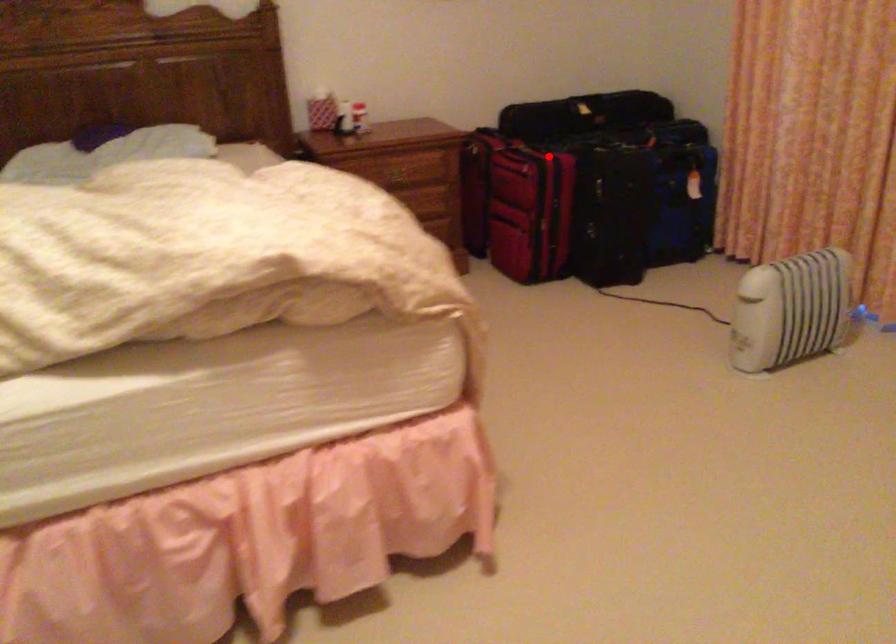
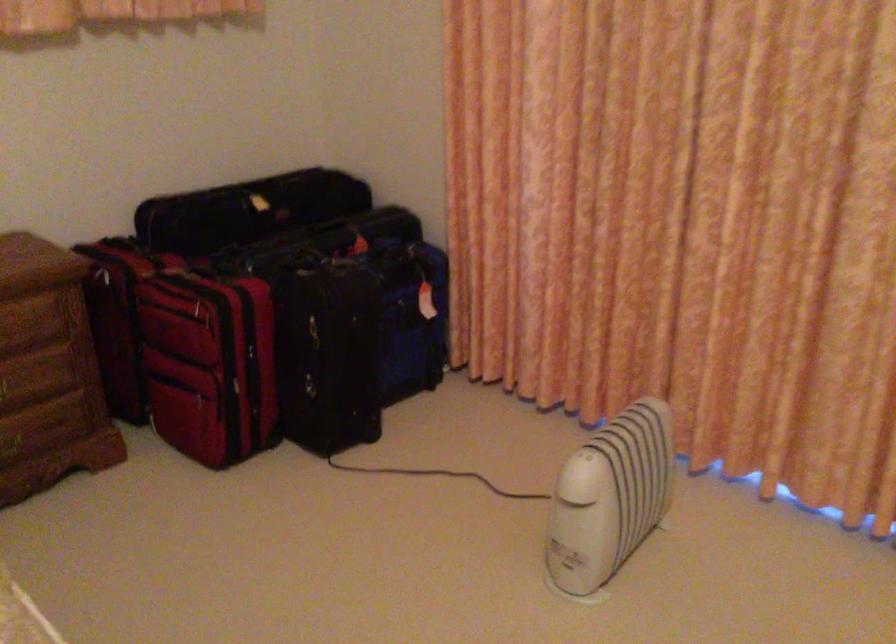
Where in the second image is the point corresponding to the highlighted location from the first image?

(243, 292)